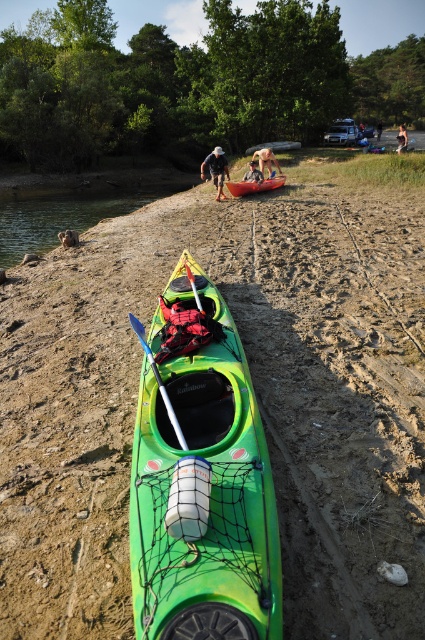
You are a photographer trying to capture a clear shot of both the dark blue fabric shirt at upper center and the skinny man at center. Based on their positions, which one will appear closer to the camera in the photo?

The dark blue fabric shirt at upper center will appear closer to the camera because it is positioned in front of the skinny man at center.

What object is located at the coordinates point (193, 285) in the image?

The point (193, 285) indicates the blue plastic paddle at center.

You are standing on the lakeside and see the blue plastic paddle at center and the skinny man at center. Which object is closer to you?

The blue plastic paddle at center is closer to you because it is in front of the skinny man at center.